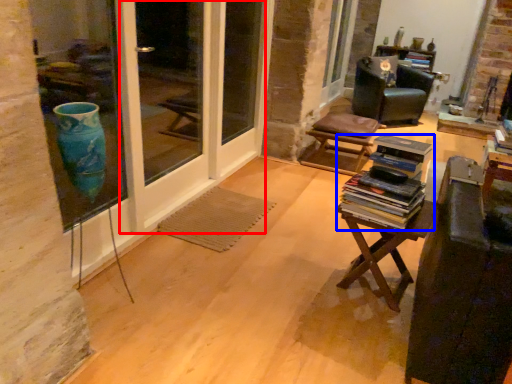
Question: Which object is further to the camera taking this photo, screen door (highlighted by a red box) or book (highlighted by a blue box)?

Choices:
 (A) screen door
 (B) book

Answer: (A)